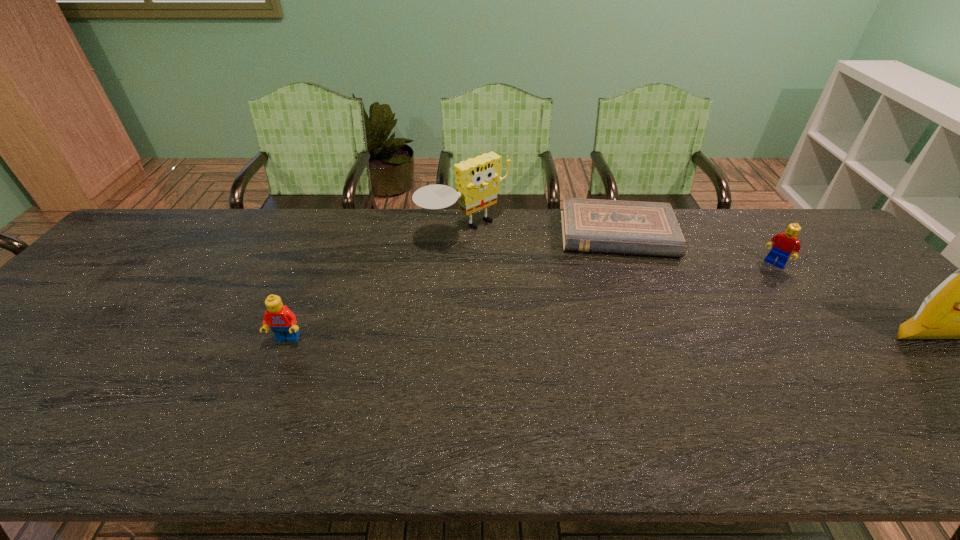
Locate an element on the screen. The image size is (960, 540). the left Lego is located at coordinates (282, 321).

This screenshot has width=960, height=540. Identify the location of the nearer Lego. (282, 321).

Find the location of a particular element. The width and height of the screenshot is (960, 540). the fourth object from left to right is located at coordinates (784, 244).

Where is `the farther Lego`? the farther Lego is located at coordinates (784, 244).

At what (x,y) coordinates should I click in order to perform the action: click on the fourth shortest object. Please return your answer as a coordinate pair (x, y). This screenshot has width=960, height=540. Looking at the image, I should click on (477, 180).

You are a GUI agent. You are given a task and a screenshot of the screen. Output one action in this format:
    pyautogui.click(x=<x>, y=<y>)
    Task: Click on the sponge
    Image resolution: width=960 pixels, height=540 pixels.
    Given the screenshot: What is the action you would take?
    pyautogui.click(x=477, y=180)

The image size is (960, 540). What are the coordinates of `Bible` in the screenshot? It's located at (588, 225).

The width and height of the screenshot is (960, 540). I want to click on the shortest object, so click(x=588, y=225).

The height and width of the screenshot is (540, 960). I want to click on vacant space located on the face of the leftmost object, so click(x=261, y=402).

Identify the location of vacant space positioned on the front-facing side of the fourth object from left to right. (732, 311).